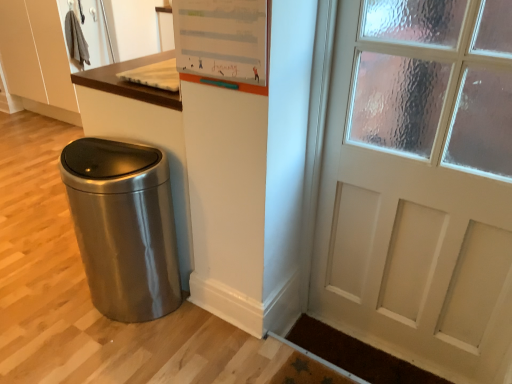
Question: Considering the relative sizes of brown textured mat at lower right and satin metallic trash can at lower left in the image provided, is brown textured mat at lower right thinner than satin metallic trash can at lower left?

Choices:
 (A) no
 (B) yes

Answer: (B)

Question: Does brown textured mat at lower right appear on the right side of satin metallic trash can at lower left?

Choices:
 (A) yes
 (B) no

Answer: (A)

Question: Can you confirm if brown textured mat at lower right is wider than satin metallic trash can at lower left?

Choices:
 (A) no
 (B) yes

Answer: (A)

Question: Is the position of brown textured mat at lower right less distant than that of satin metallic trash can at lower left?

Choices:
 (A) no
 (B) yes

Answer: (A)

Question: Is brown textured mat at lower right at the left side of satin metallic trash can at lower left?

Choices:
 (A) no
 (B) yes

Answer: (A)

Question: Is brown textured mat at lower right taller or shorter than satin metallic trash can at lower left?

Choices:
 (A) short
 (B) tall

Answer: (A)

Question: In terms of size, does brown textured mat at lower right appear bigger or smaller than satin metallic trash can at lower left?

Choices:
 (A) big
 (B) small

Answer: (B)

Question: From a real-world perspective, is brown textured mat at lower right physically located above or below satin metallic trash can at lower left?

Choices:
 (A) below
 (B) above

Answer: (A)

Question: From the image's perspective, is brown textured mat at lower right positioned above or below satin metallic trash can at lower left?

Choices:
 (A) above
 (B) below

Answer: (B)

Question: In terms of height, does satin metallic trash can at lower left look taller or shorter compared to white matte dry erase board at upper center?

Choices:
 (A) tall
 (B) short

Answer: (A)

Question: Considering the positions of satin metallic trash can at lower left and white matte dry erase board at upper center in the image, is satin metallic trash can at lower left bigger or smaller than white matte dry erase board at upper center?

Choices:
 (A) small
 (B) big

Answer: (B)

Question: From a real-world perspective, relative to white matte dry erase board at upper center, is satin metallic trash can at lower left vertically above or below?

Choices:
 (A) below
 (B) above

Answer: (A)

Question: From the image's perspective, is satin metallic trash can at lower left positioned above or below white matte dry erase board at upper center?

Choices:
 (A) above
 (B) below

Answer: (B)

Question: Does point (122, 246) appear closer or farther from the camera than point (344, 359)?

Choices:
 (A) farther
 (B) closer

Answer: (B)

Question: From the image's perspective, is satin metallic trash can at lower left located above or below brown textured mat at lower right?

Choices:
 (A) above
 (B) below

Answer: (A)